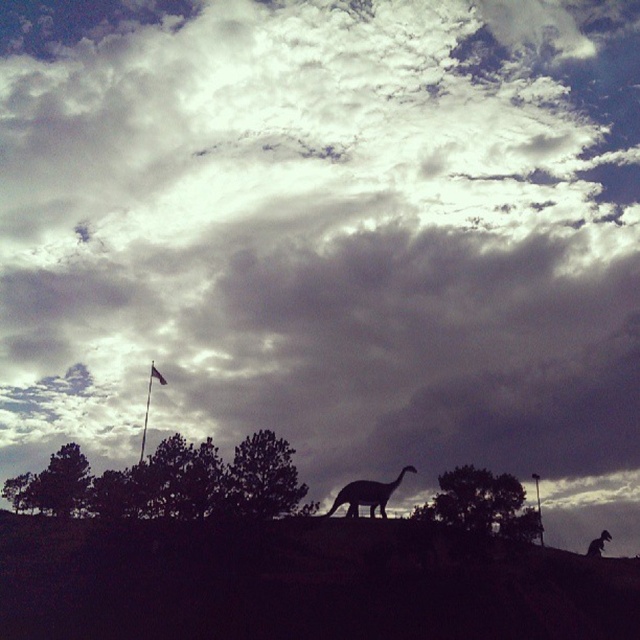
Question: Is silhouette rock at center to the left of dark green leafy tree at center from the viewer's perspective?

Choices:
 (A) yes
 (B) no

Answer: (A)

Question: Is green leafy tree at lower left in front of silhouette matte dinosaur at center?

Choices:
 (A) yes
 (B) no

Answer: (B)

Question: Which object appears closest to the camera in this image?

Choices:
 (A) dark green leafy trees at lower center
 (B) silhouette rock at center

Answer: (B)

Question: Does dark green leafy trees at lower center appear on the left side of green leafy tree at center?

Choices:
 (A) no
 (B) yes

Answer: (B)

Question: Which object is positioned closest to the silhouette dinosaur at center?

Choices:
 (A) silhouette matte dinosaur at center
 (B) green leafy tree at lower left
 (C) silhouette rock at center
 (D) dark green leafy trees at lower center

Answer: (A)

Question: Which object is farther from the camera taking this photo?

Choices:
 (A) dark green leafy tree at center
 (B) dark green leafy trees at lower center

Answer: (B)